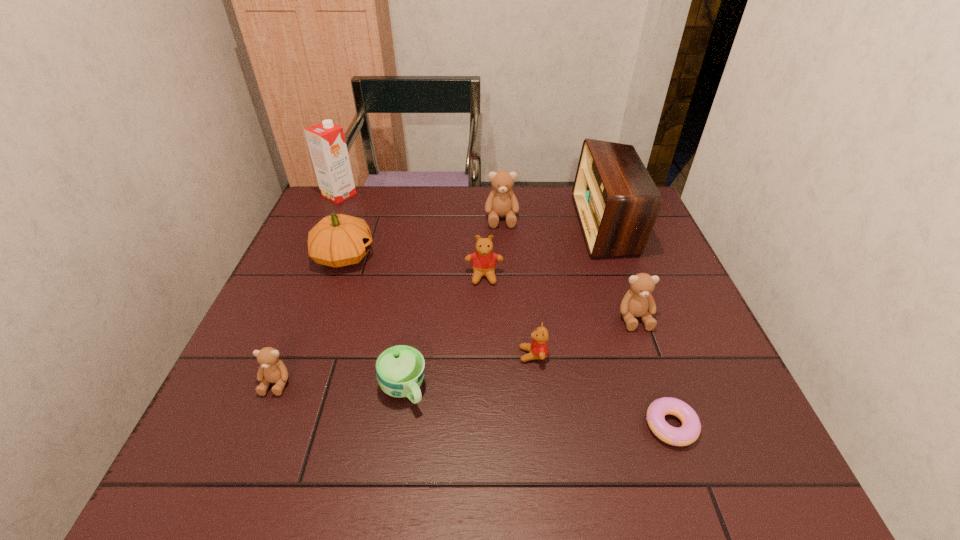
Identify the location of free region located 0.310m on the front-facing side of the biggest brown teddy bear. Image resolution: width=960 pixels, height=540 pixels. (507, 303).

The image size is (960, 540). I want to click on vacant space located on the side of the gourd with the carved face, so click(x=430, y=256).

The image size is (960, 540). I want to click on free space located on the front-facing side of the farther red teddy bear, so click(x=486, y=399).

Where is `vacant space located 0.290m on the front-facing side of the third farthest teddy bear`? This screenshot has width=960, height=540. vacant space located 0.290m on the front-facing side of the third farthest teddy bear is located at coordinates (683, 454).

Locate an element on the screen. This screenshot has width=960, height=540. free region located 0.110m on the front-facing side of the right red teddy bear is located at coordinates (469, 355).

This screenshot has height=540, width=960. I want to click on vacant space located 0.100m on the front-facing side of the right red teddy bear, so click(x=474, y=355).

At what (x,y) coordinates should I click in order to perform the action: click on vacant space located 0.050m on the front-facing side of the right red teddy bear. Please return your answer as a coordinate pair (x, y). The height and width of the screenshot is (540, 960). Looking at the image, I should click on (497, 355).

Locate an element on the screen. vacant space located 0.100m on the front-facing side of the nearest brown teddy bear is located at coordinates (252, 444).

This screenshot has width=960, height=540. Identify the location of free region located 0.290m on the left of the cup. (237, 389).

The width and height of the screenshot is (960, 540). I want to click on free space located 0.090m on the right of the doughnut, so click(x=743, y=425).